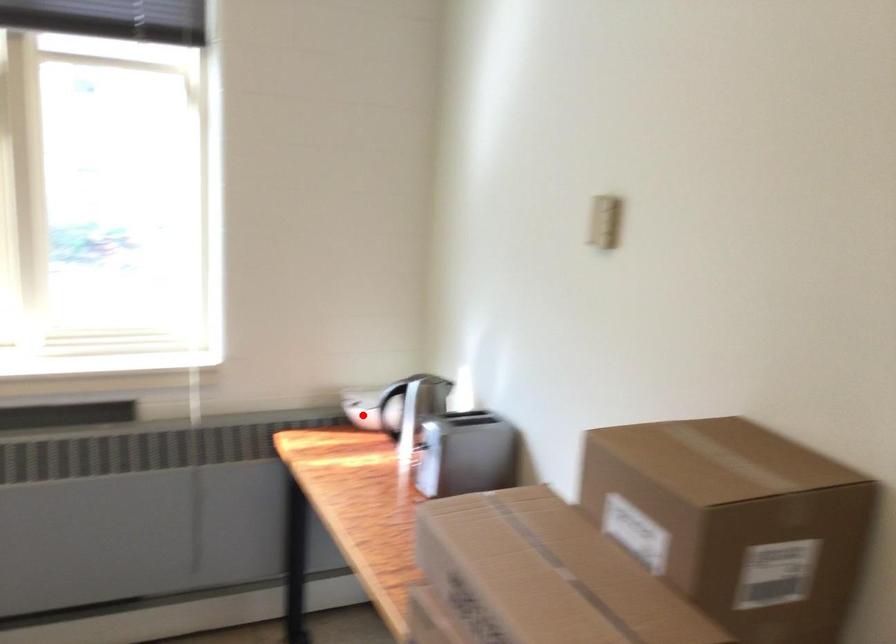
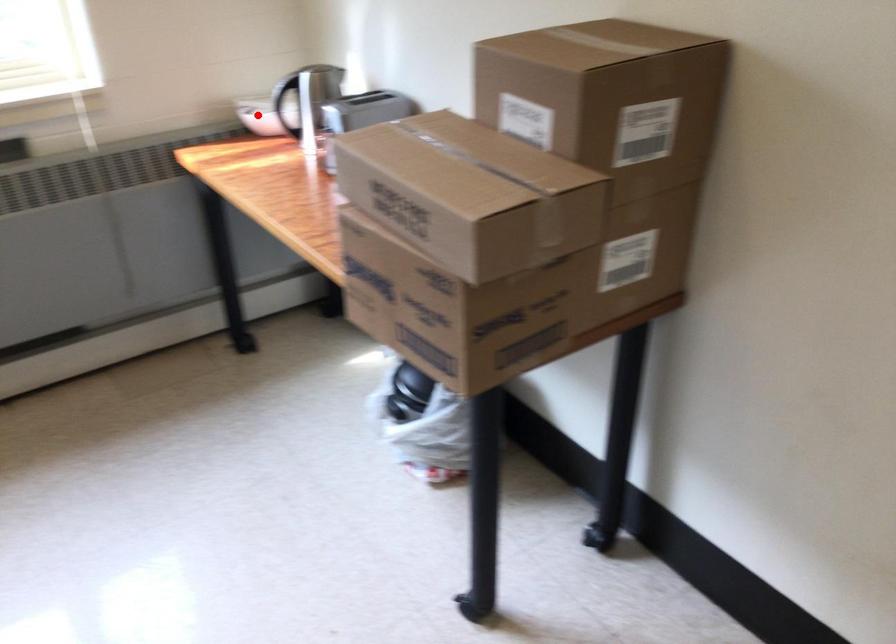
I am providing you with two images of the same scene from different viewpoints. A red point is marked on the first image and another point is marked on the second image. Do the highlighted points in image1 and image2 indicate the same real-world spot?

Yes